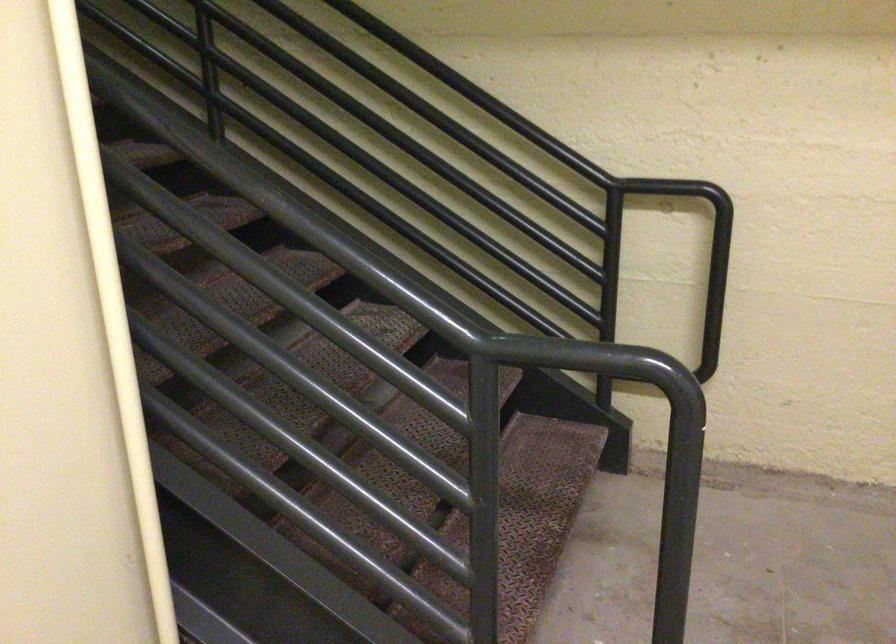
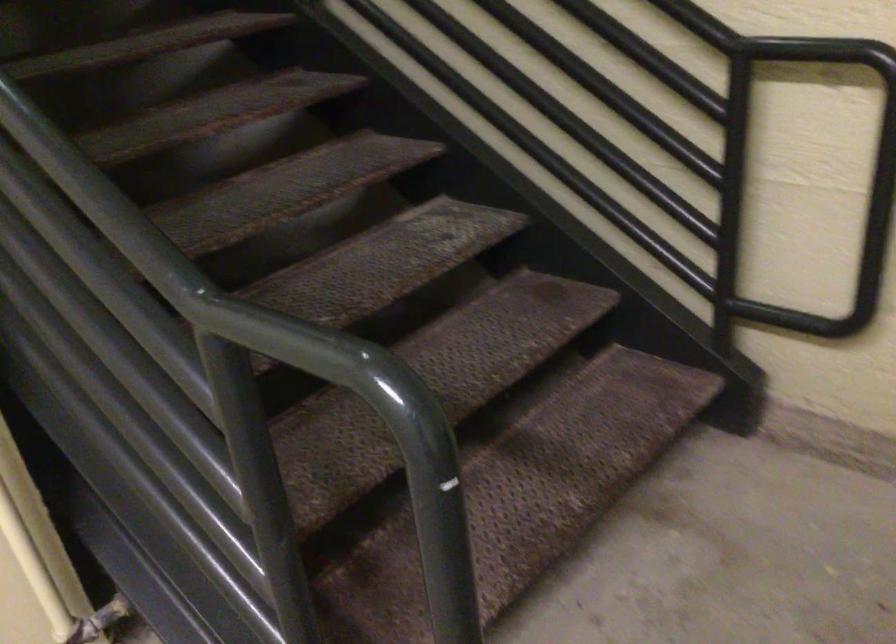
In a continuous first-person perspective shot, in which direction is the camera moving?

The movement direction of the cameraman is right, forward.